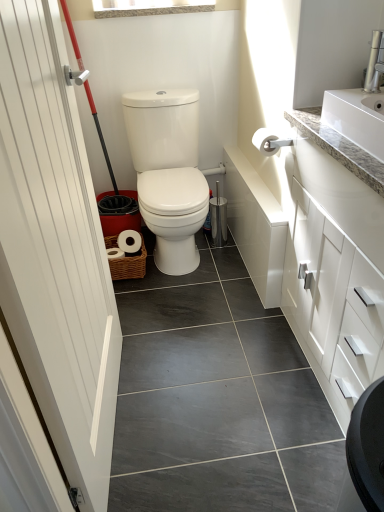
Question: Is white wood door at left inside the boundaries of white glossy cabinet at upper right, or outside?

Choices:
 (A) inside
 (B) outside

Answer: (B)

Question: From the image's perspective, relative to white glossy cabinet at upper right, is white wood door at left above or below?

Choices:
 (A) below
 (B) above

Answer: (B)

Question: Which is farther from the white glossy toilet at center?

Choices:
 (A) silver metallic faucet at upper right
 (B) white matte toilet paper at center
 (C) white wood door at left
 (D) white glossy cabinet at upper right
 (E) woven brown basket at lower center

Answer: (A)

Question: Considering the real-world distances, which object is closest to the white wood door at left?

Choices:
 (A) silver metallic faucet at upper right
 (B) white glossy cabinet at upper right
 (C) white matte toilet paper at center
 (D) woven brown basket at lower center
 (E) white glossy toilet at center

Answer: (B)